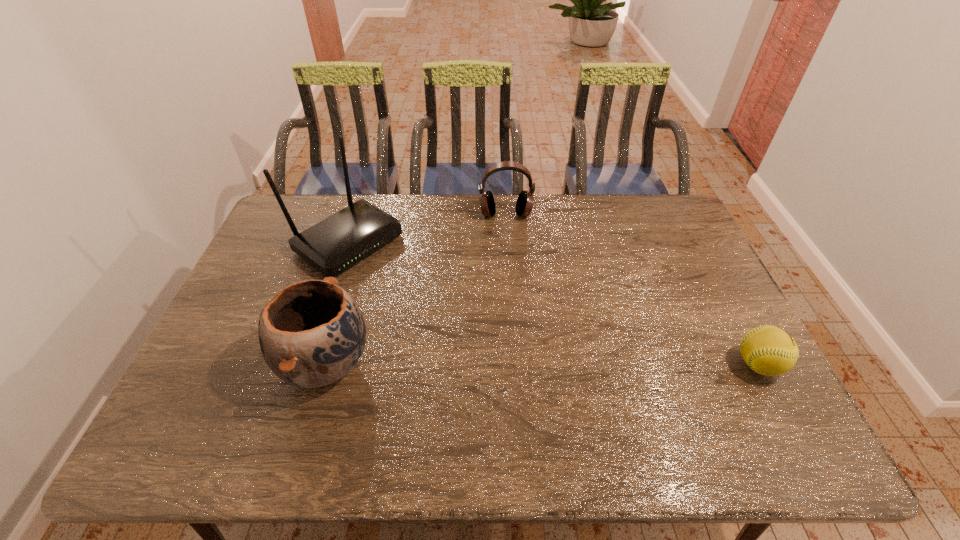
I want to click on free spot on the desktop that is between the pottery and the softball and is positioned on the ear pads of the third object from left to right, so click(516, 364).

Identify the location of vacant space on the desktop that is between the pottery and the softball and is positioned on the front-facing side of the router. This screenshot has width=960, height=540. tap(525, 364).